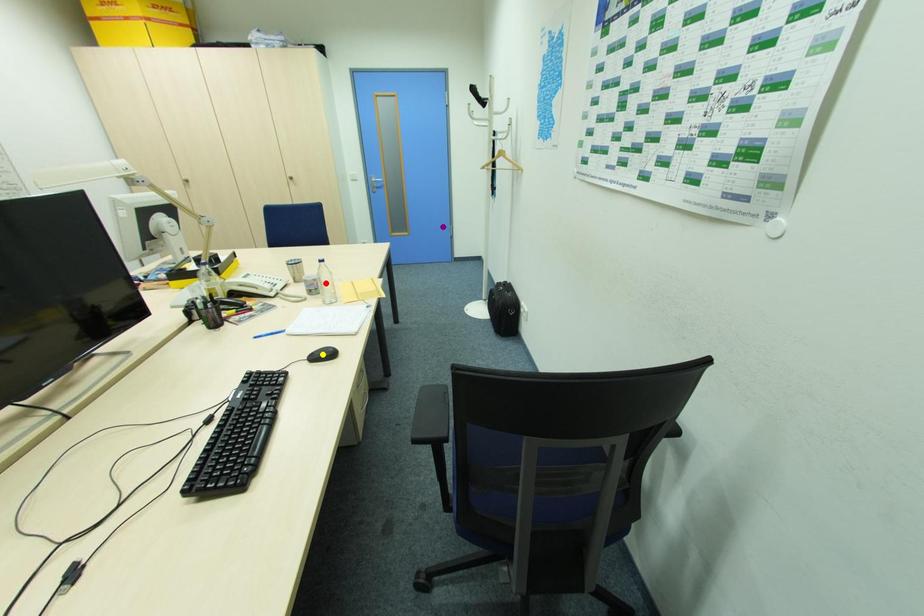
Order these from nearest to farthest:
purple point
red point
yellow point

1. yellow point
2. red point
3. purple point